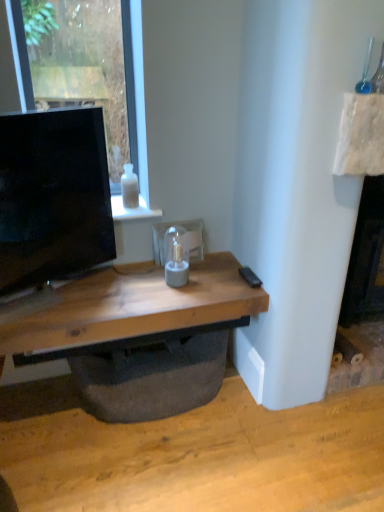
Where is `vacant space situated on the left part of black plastic remote at lower right`? vacant space situated on the left part of black plastic remote at lower right is located at coordinates (210, 281).